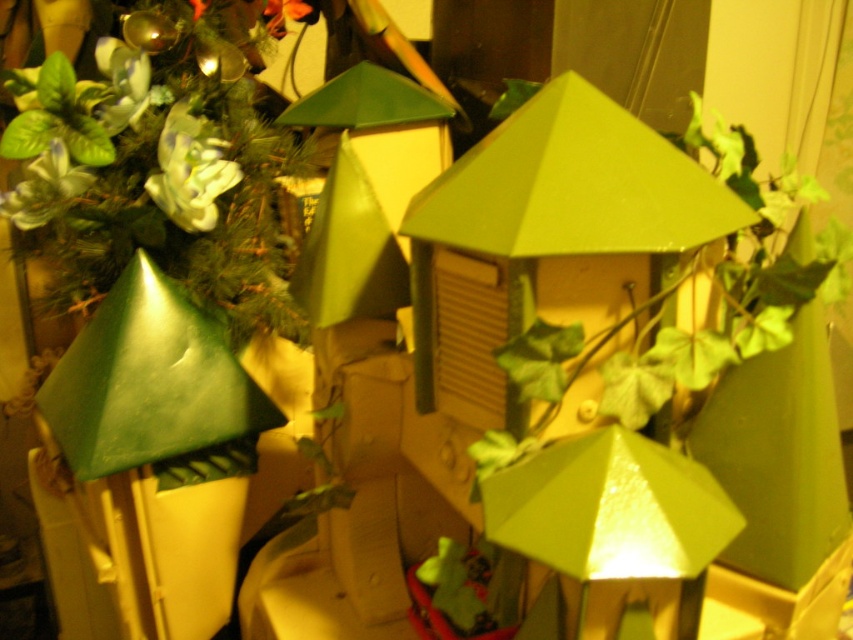
You are setting up a miniature village display and want to place the green matte plant at left and the matte green lamp at center. Which object should you place first if you want the larger one to be positioned at the back for depth?

You should place the green matte plant at left first since it is larger than the matte green lamp at center, allowing it to be positioned at the back for depth.

In the scene shown: You are setting up a display for a craft fair and need to arrange the green matte plant at left and the matte green lamp at center. The display requires that the taller object be placed in the back to avoid blocking the view of the shorter one. Which object should be placed at the back?

The green matte plant at left is taller than the matte green lamp at center, so it should be placed at the back to avoid blocking the view of the lamp.

You are a visitor looking at the miniature structures. You see the green matte plant at left and the matte green lamp at center. Which object is closer to you?

The green matte plant at left is closer to you because the matte green lamp at center is behind it.